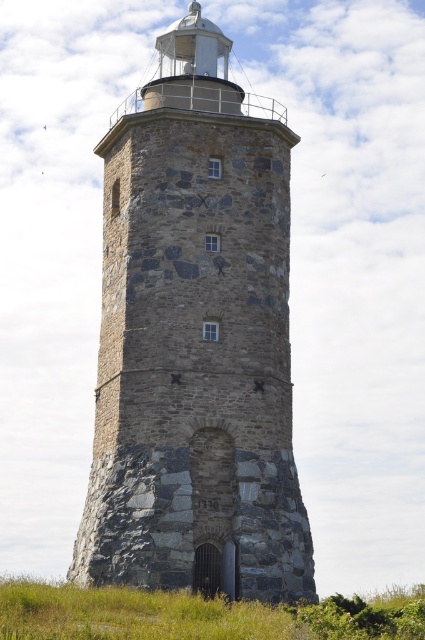
Between gray stone tower at center and green grass at lower center, which one has more height?

gray stone tower at center is taller.

Is point (240, 298) closer to camera compared to point (414, 608)?

No, it is not.

At what (x,y) coordinates should I click in order to perform the action: click on gray stone tower at center. Please return your answer as a coordinate pair (x, y). Looking at the image, I should click on (195, 340).